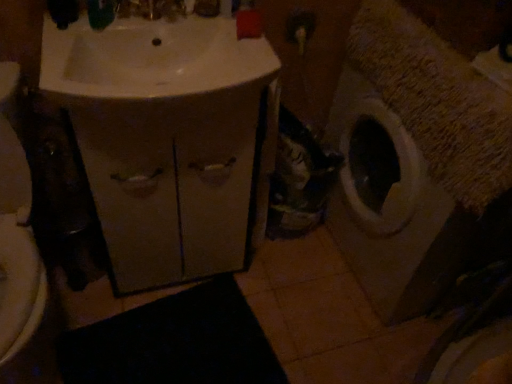
Find the location of a particular element. vacant region below black rubber bath mat at lower center (from a real-world perspective) is located at coordinates (181, 352).